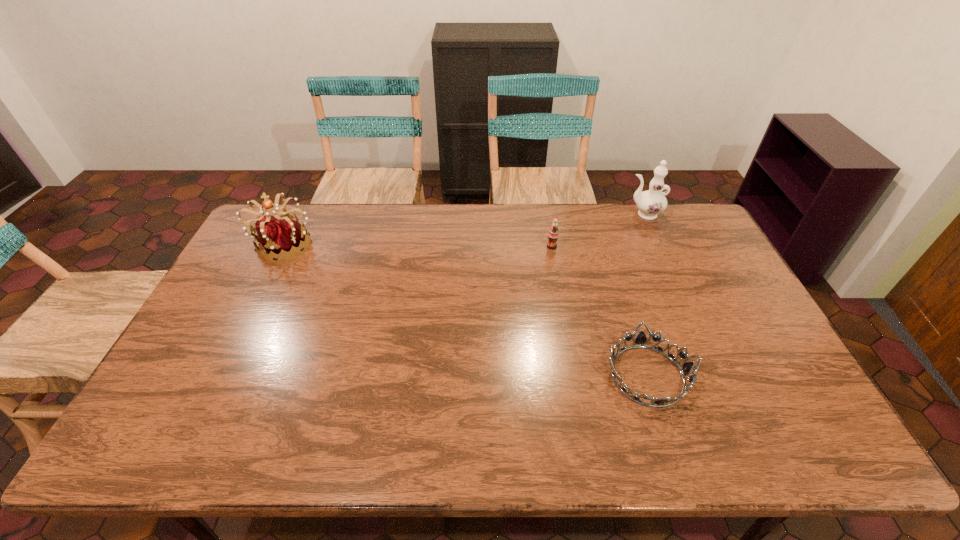
What are the coordinates of `free spot between the shorter tiara and the chinaware` in the screenshot? It's located at (645, 295).

The image size is (960, 540). In order to click on free point between the right tiara and the chinaware in this screenshot , I will do `click(645, 295)`.

At what (x,y) coordinates should I click in order to perform the action: click on vacant space in between the taller tiara and the farthest object. Please return your answer as a coordinate pair (x, y). The image size is (960, 540). Looking at the image, I should click on (464, 229).

You are a GUI agent. You are given a task and a screenshot of the screen. Output one action in this format:
    pyautogui.click(x=<x>, y=<y>)
    Task: Click on the empty location between the nearest object and the soda
    The image size is (960, 540).
    Given the screenshot: What is the action you would take?
    pyautogui.click(x=599, y=311)

Find the location of a particular element. vacant area that lies between the taller tiara and the third tallest object is located at coordinates (419, 245).

Locate an element on the screen. free space between the chinaware and the left tiara is located at coordinates (464, 229).

Locate which object ranks third in proximity to the nearer tiara. Please provide its 2D coordinates. Your answer should be formatted as a tuple, i.e. [(x, y)], where the tuple contains the x and y coordinates of a point satisfying the conditions above.

[(282, 237)]

At what (x,y) coordinates should I click in order to perform the action: click on object that stands as the third closest to the chinaware. Please return your answer as a coordinate pair (x, y). Looking at the image, I should click on (282, 237).